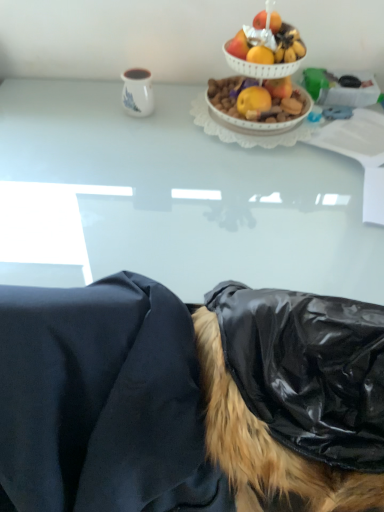
This screenshot has height=512, width=384. In order to click on free point in front of shiny white bowl at upper center in this screenshot , I will do `click(237, 152)`.